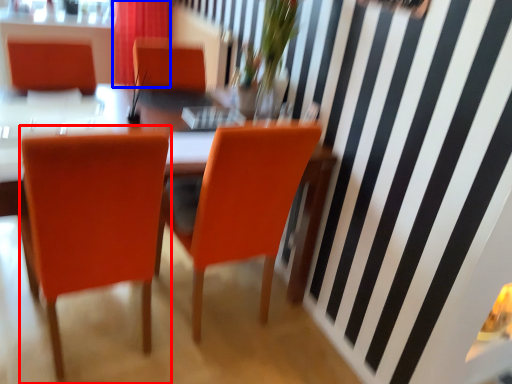
Question: Which object is further to the camera taking this photo, chair (highlighted by a red box) or curtain (highlighted by a blue box)?

Choices:
 (A) chair
 (B) curtain

Answer: (B)